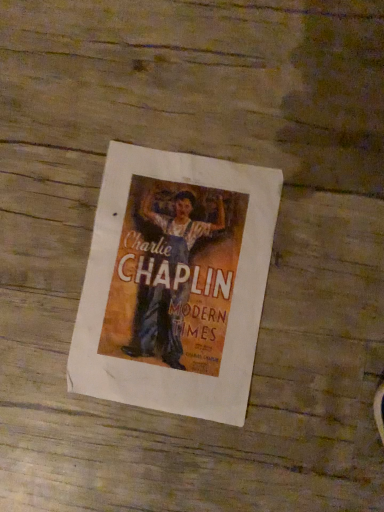
Find the location of a particular element. Image resolution: width=384 pixels, height=512 pixels. blank space above matte paper poster at center (from a real-world perspective) is located at coordinates (171, 280).